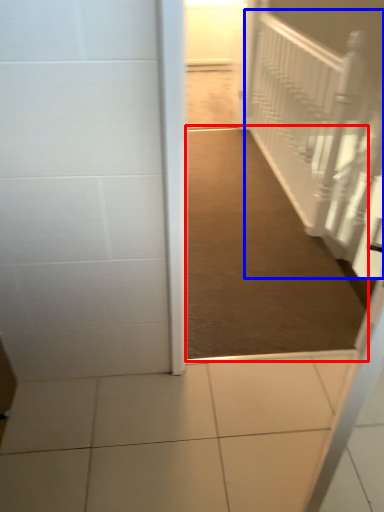
Question: Which of the following is the closest to the observer, path (highlighted by a red box) or stairwell (highlighted by a blue box)?

Choices:
 (A) path
 (B) stairwell

Answer: (A)